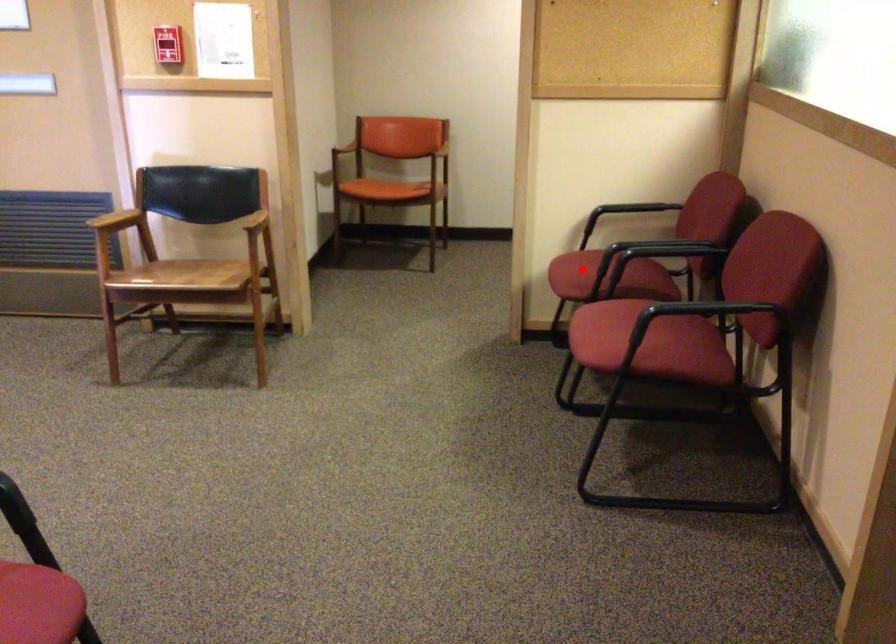
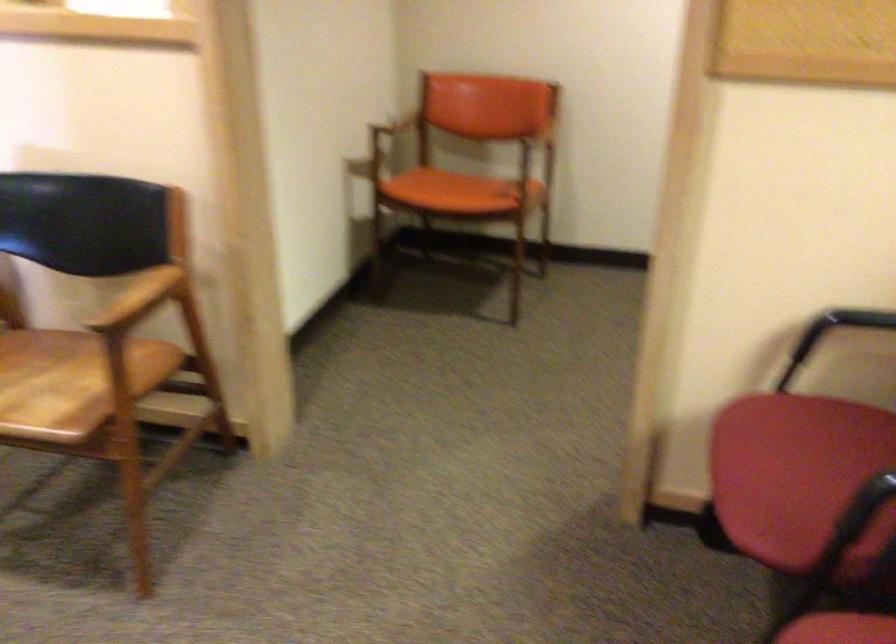
Find the pixel in the second image that matches the highlighted location in the first image.

(798, 477)